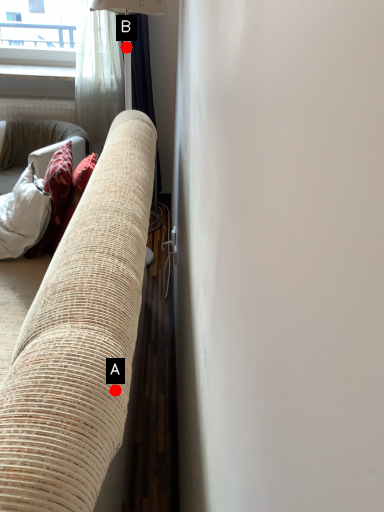
Question: Two points are circled on the image, labeled by A and B beside each circle. Among these points, which one is farthest from the camera?

Choices:
 (A) A is further
 (B) B is further

Answer: (B)